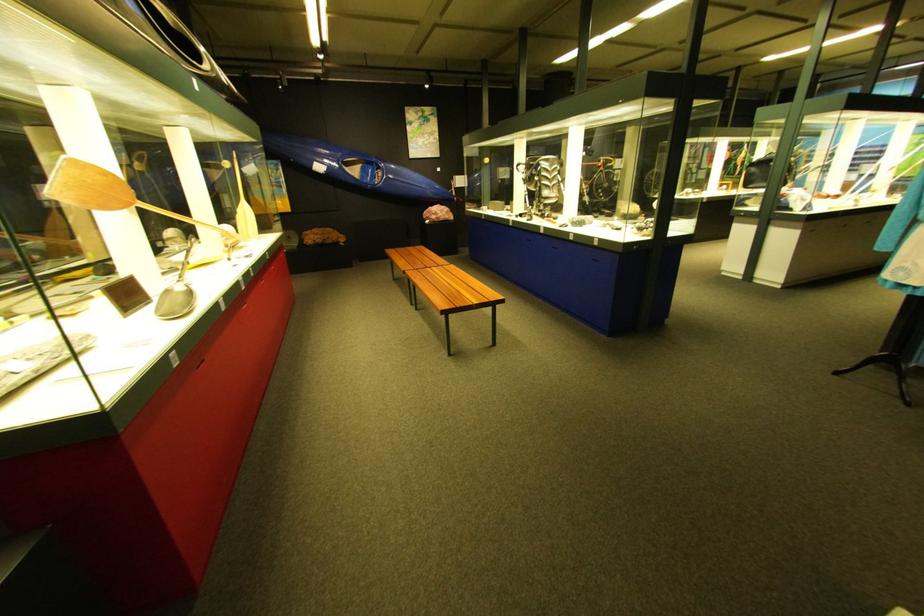
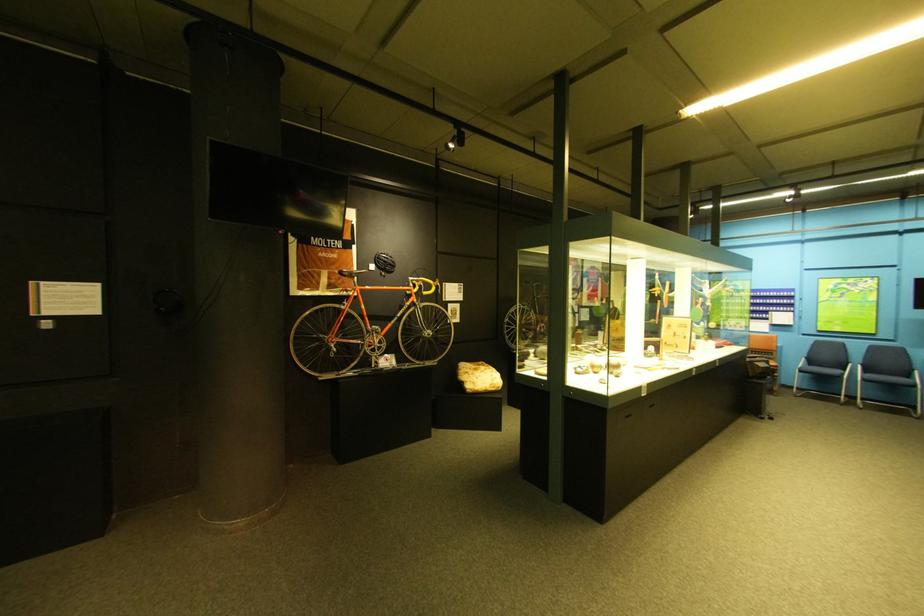
In the second image, find the point that corresponds to pixel 600 156 in the first image.

(388, 269)